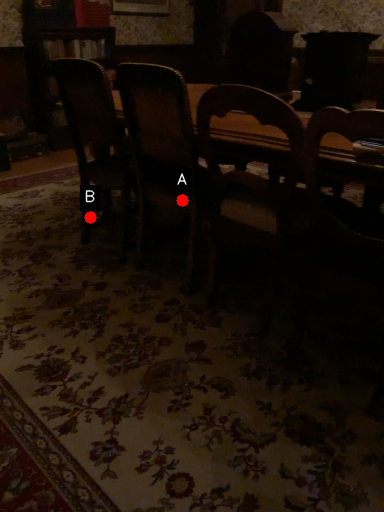
Question: Two points are circled on the image, labeled by A and B beside each circle. Which of the following is the closest to the observer?

Choices:
 (A) A is closer
 (B) B is closer

Answer: (A)